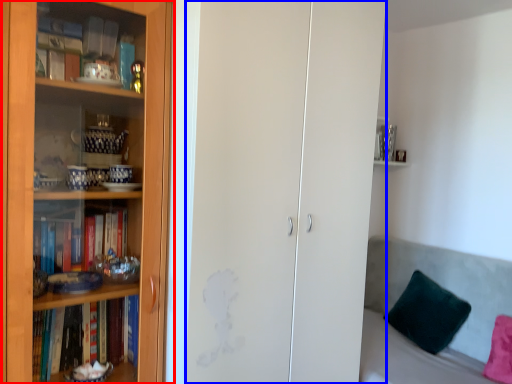
Question: Which object is closer to the camera taking this photo, bookcase (highlighted by a red box) or glass door (highlighted by a blue box)?

Choices:
 (A) bookcase
 (B) glass door

Answer: (A)